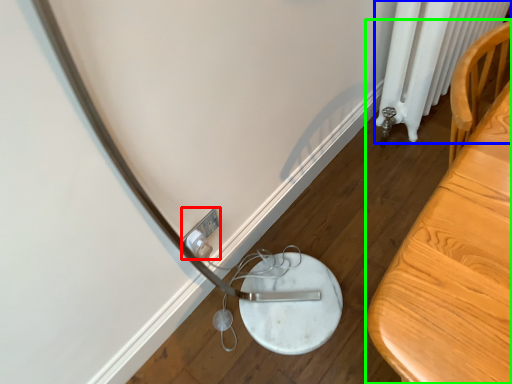
Question: Which object is the closest to the electric outlet (highlighted by a red box)? Choose among these: radiator (highlighted by a blue box) or furniture (highlighted by a green box).

Choices:
 (A) radiator
 (B) furniture

Answer: (B)